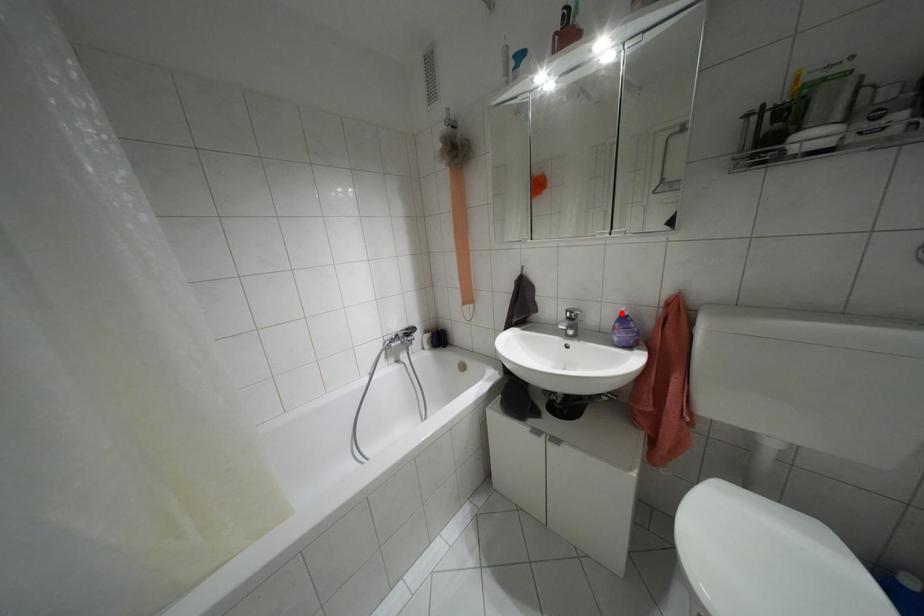
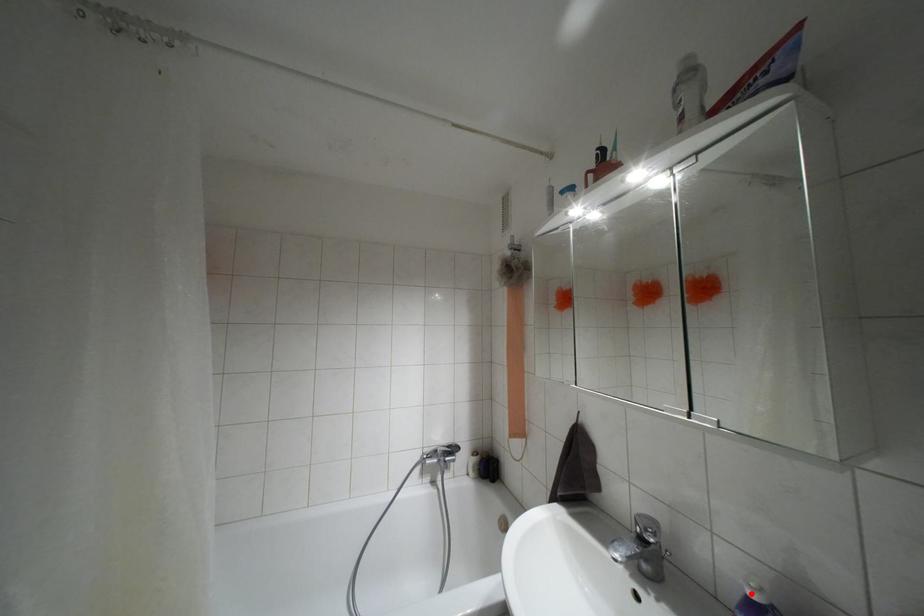
I am providing you with two images of the same scene from different viewpoints. A red point is marked on the first image and another point is marked on the second image. Does the point marked in image1 correspond to the same location as the one in image2?

Yes